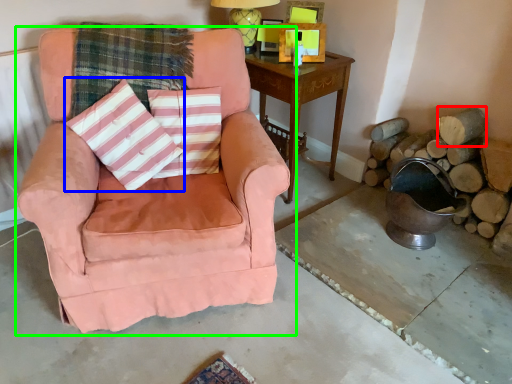
Question: Considering the real-world distances, which object is closest to wood (highlighted by a red box)? throw pillow (highlighted by a blue box) or chair (highlighted by a green box).

Choices:
 (A) throw pillow
 (B) chair

Answer: (B)